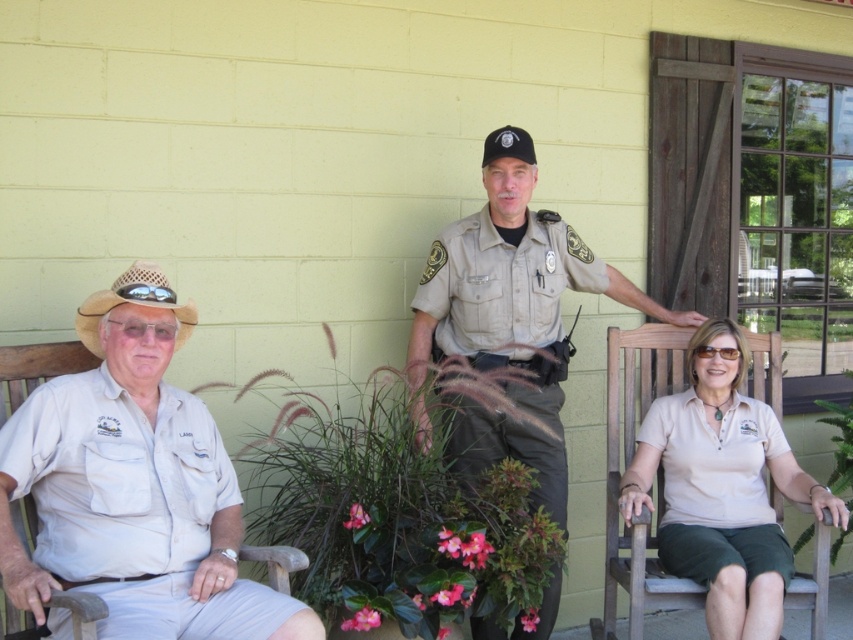
Between point (776, 376) and point (737, 410), which one is positioned behind?

Positioned behind is point (776, 376).

Does beige fabric shirt at center come in front of beige cotton shirt at lower right?

Yes, it is in front of beige cotton shirt at lower right.

The image size is (853, 640). Describe the element at coordinates (722, 486) in the screenshot. I see `beige fabric shirt at center` at that location.

Image resolution: width=853 pixels, height=640 pixels. In order to click on beige fabric shirt at center in this screenshot , I will do `click(722, 486)`.

Which is above, beige fabric shirt at left or tan uniform at center?

tan uniform at center is above.

Does beige fabric shirt at left lie behind tan uniform at center?

No, it is not.

Is point (4, 572) closer to camera compared to point (419, 422)?

Yes.

This screenshot has width=853, height=640. I want to click on beige fabric shirt at left, so click(134, 484).

Can you confirm if beige fabric shirt at left is thinner than tan straw cowboy hat at left?

No, beige fabric shirt at left is not thinner than tan straw cowboy hat at left.

Does point (199, 595) come behind point (114, 288)?

That is False.

Image resolution: width=853 pixels, height=640 pixels. Identify the location of beige fabric shirt at left. (134, 484).